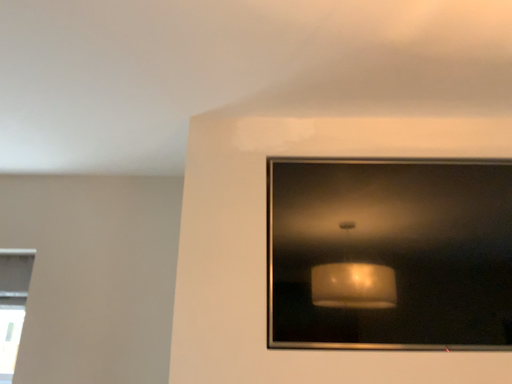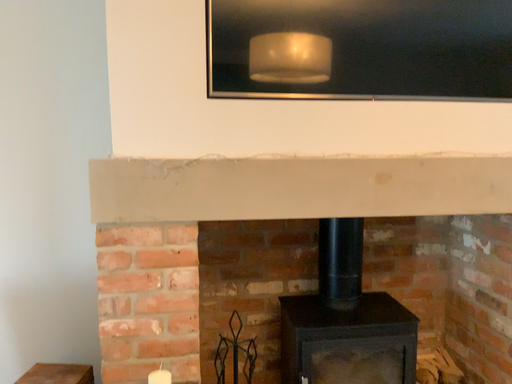
Question: Which way did the camera rotate in the video?

Choices:
 (A) rotated right
 (B) rotated left

Answer: (A)